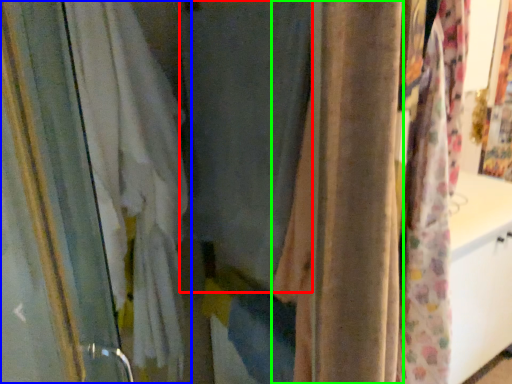
Question: Considering the real-world distances, which object is farthest from curtain (highlighted by a red box)? curtain (highlighted by a blue box) or curtain (highlighted by a green box)?

Choices:
 (A) curtain
 (B) curtain

Answer: (A)